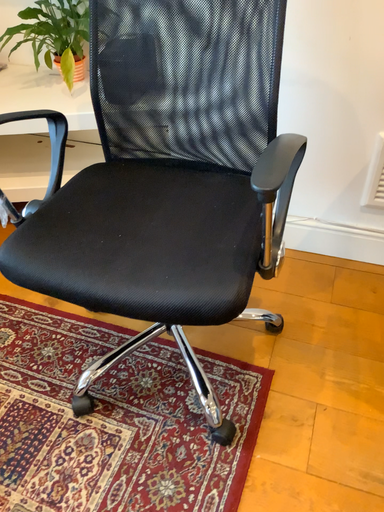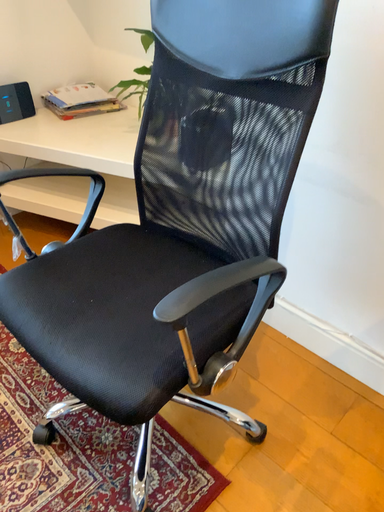
Question: How did the camera likely rotate when shooting the video?

Choices:
 (A) rotated right
 (B) rotated left

Answer: (B)